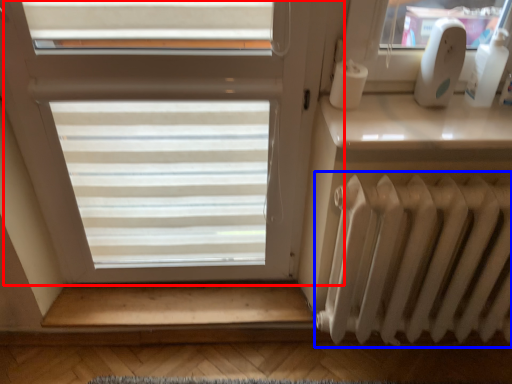
Question: Among these objects, which one is farthest to the camera, window (highlighted by a red box) or radiator (highlighted by a blue box)?

Choices:
 (A) window
 (B) radiator

Answer: (B)